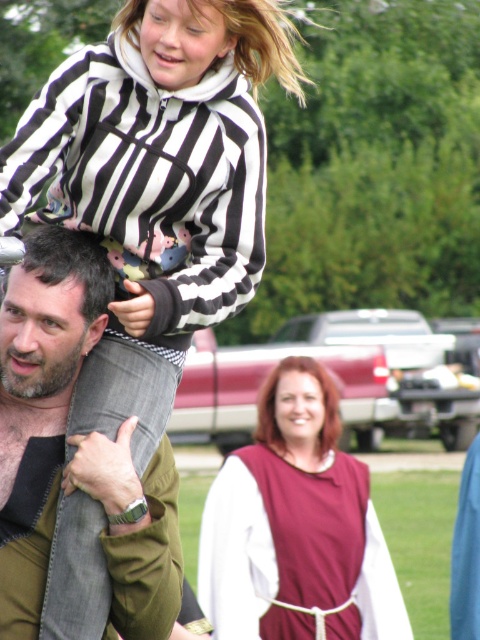
Question: Which point is closer to the camera taking this photo?

Choices:
 (A) (72, 380)
 (B) (141, 1)

Answer: (B)

Question: Which of the following is the farthest from the observer?

Choices:
 (A) smooth burgundy fabric at center
 (B) denim jeans at upper left
 (C) matte burgundy tunic at center
 (D) bearded man at center

Answer: (A)

Question: Does denim jeans at upper left appear over bearded man at center?

Choices:
 (A) yes
 (B) no

Answer: (B)

Question: Is smooth burgundy fabric at center to the left of striped fleece at upper center from the viewer's perspective?

Choices:
 (A) yes
 (B) no

Answer: (B)

Question: Can you confirm if denim jeans at upper left is positioned below bearded man at center?

Choices:
 (A) yes
 (B) no

Answer: (A)

Question: Which of the following is the farthest from the observer?

Choices:
 (A) (164, 528)
 (B) (286, 500)

Answer: (B)